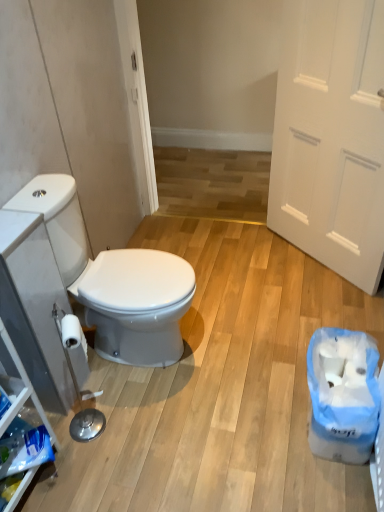
You are a GUI agent. You are given a task and a screenshot of the screen. Output one action in this format:
    pyautogui.click(x=<x>, y=<y>)
    Task: Click on the vacant position to the left of blue plastic bag at lower right
    
    Given the screenshot: What is the action you would take?
    [256, 419]